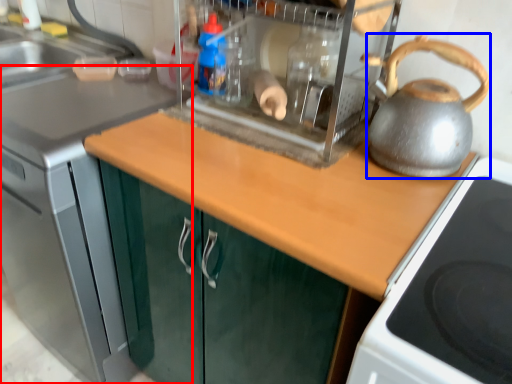
Question: Which object is closer to the camera taking this photo, countertop (highlighted by a red box) or kettle (highlighted by a blue box)?

Choices:
 (A) countertop
 (B) kettle

Answer: (B)